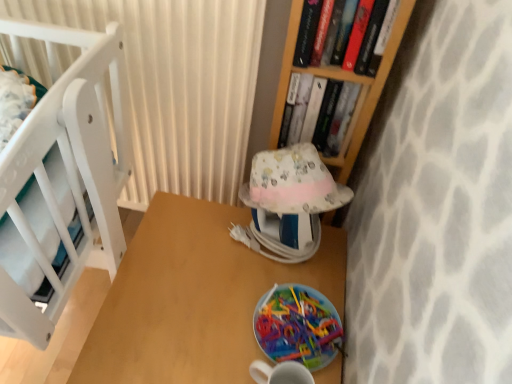
You are a GUI agent. You are given a task and a screenshot of the screen. Output one action in this format:
    pyautogui.click(x=<x>, y=<y>)
    Task: Click on the vacant area on the back side of translucent plastic plate at lower center
    The image size is (512, 384).
    Given the screenshot: What is the action you would take?
    pyautogui.click(x=291, y=258)